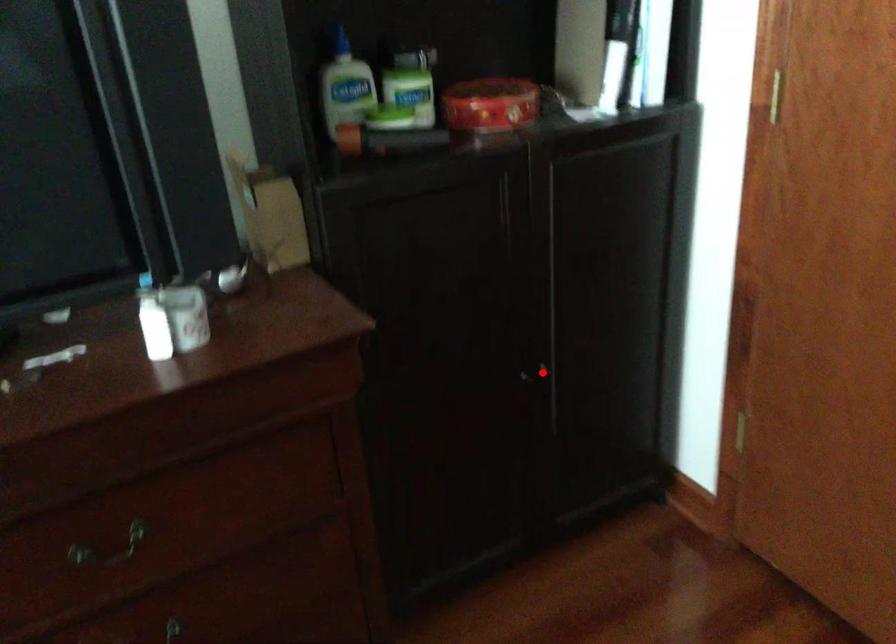
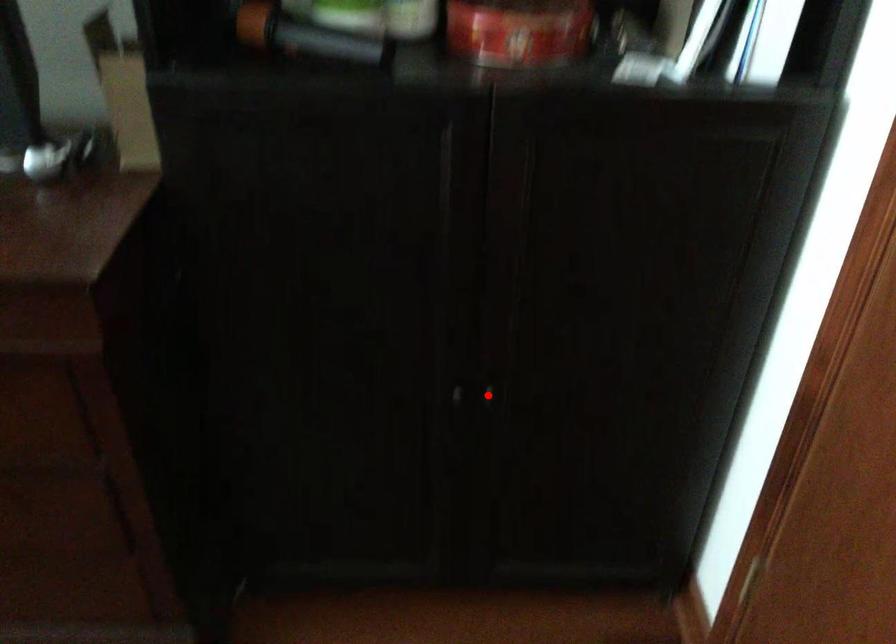
I am providing you with two images of the same scene from different viewpoints. A red point is marked on the first image and another point is marked on the second image. Do the highlighted points in image1 and image2 indicate the same real-world spot?

Yes